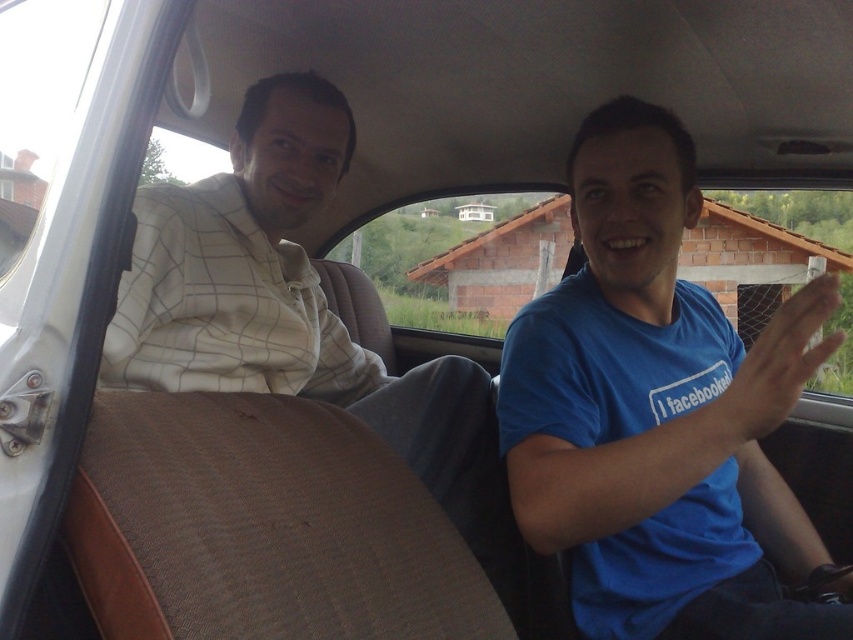
Question: Where is blue cotton shirt at center located in relation to white checkered shirt at center in the image?

Choices:
 (A) below
 (B) above

Answer: (B)

Question: Which of the following is the closest to the observer?

Choices:
 (A) white checkered shirt at center
 (B) blue cotton shirt at center

Answer: (B)

Question: Does blue cotton shirt at center have a smaller size compared to white checkered shirt at center?

Choices:
 (A) no
 (B) yes

Answer: (B)

Question: From the image, what is the correct spatial relationship of blue cotton shirt at center in relation to white checkered shirt at center?

Choices:
 (A) below
 (B) above

Answer: (B)

Question: Which of the following is the closest to the observer?

Choices:
 (A) (683, 547)
 (B) (467, 464)

Answer: (A)